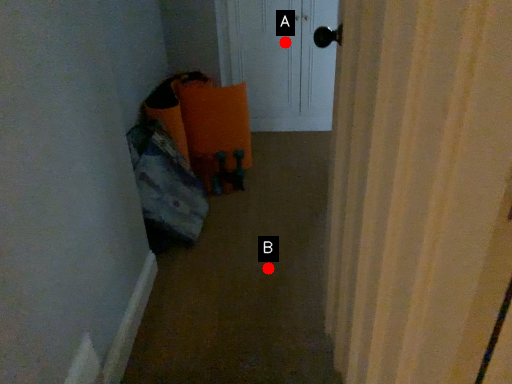
Question: Two points are circled on the image, labeled by A and B beside each circle. Among these points, which one is farthest from the camera?

Choices:
 (A) A is further
 (B) B is further

Answer: (A)